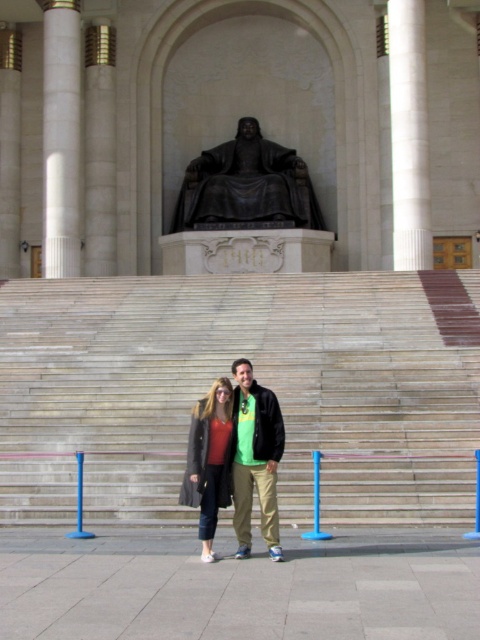
Between bronze statue at center and white marble column at left, which one is positioned higher?

white marble column at left is above.

Is point (263, 225) in front of point (74, 67)?

No.

You are a GUI agent. You are given a task and a screenshot of the screen. Output one action in this format:
    pyautogui.click(x=<x>, y=<y>)
    Task: Click on the bronze statue at center
    The width and height of the screenshot is (480, 640).
    Given the screenshot: What is the action you would take?
    pyautogui.click(x=247, y=186)

In the scene shown: Can you confirm if bronze statue at center is taller than white marble pillar at right?

No.

Does bronze statue at center appear on the left side of white marble pillar at right?

Yes, bronze statue at center is to the left of white marble pillar at right.

At what (x,y) coordinates should I click in order to perform the action: click on bronze statue at center. Please return your answer as a coordinate pair (x, y). This screenshot has height=640, width=480. Looking at the image, I should click on (247, 186).

The width and height of the screenshot is (480, 640). Identify the location of bronze statue at center. (247, 186).

Does smooth stone stairs at center appear on the left side of white marble column at left?

No, smooth stone stairs at center is not to the left of white marble column at left.

Does smooth stone stairs at center lie behind white marble column at left?

No, smooth stone stairs at center is in front of white marble column at left.

Is point (46, 280) positioned in front of point (54, 260)?

Yes, it is.

Image resolution: width=480 pixels, height=640 pixels. Identify the location of smooth stone stairs at center. (229, 362).